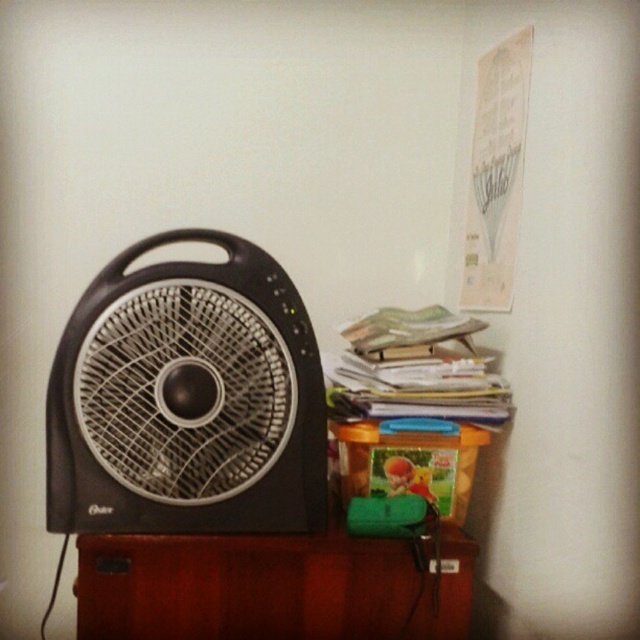
You are standing in the room and want to reach a point that is behind both point (177,412) and point (136,609). Which point should you move around to access the desired location?

To reach the point behind both points, you should move around point (136,609) because point (177,412) is in front of it, so moving around the rear point would allow access to the area behind both.

You are moving the black plastic fan at left and the brown wood table at lower center into a storage room. The doorway you are using is 1.2 meters wide. Can both items fit through the doorway side by side?

The black plastic fan at left is larger in size than brown wood table at lower center. Since the doorway is 1.2 meters wide, it is possible that both items can fit side by side if their combined widths are less than or equal to 1.2 meters. However, without specific measurements of each item, it is difficult to determine definitively.